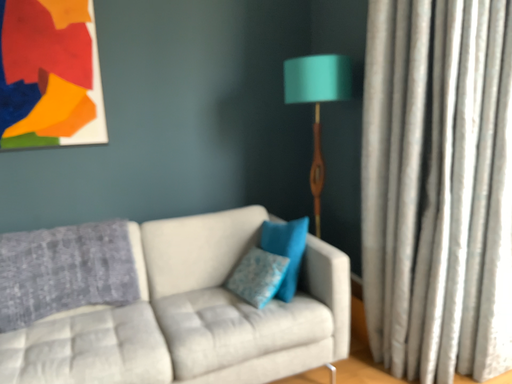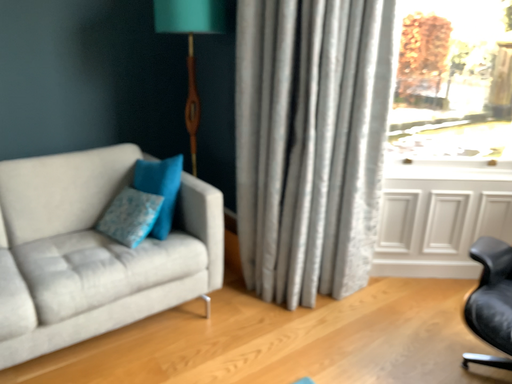
Question: Which way did the camera rotate in the video?

Choices:
 (A) rotated right
 (B) rotated left

Answer: (A)